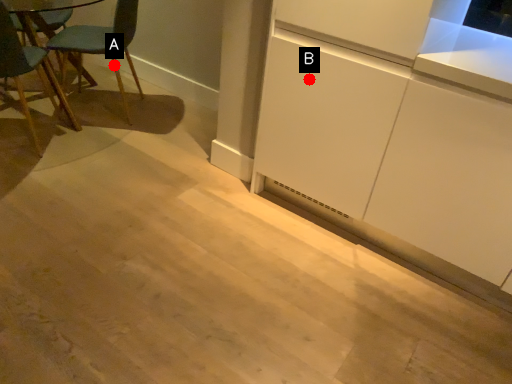
Question: Two points are circled on the image, labeled by A and B beside each circle. Which of the following is the closest to the observer?

Choices:
 (A) A is closer
 (B) B is closer

Answer: (B)